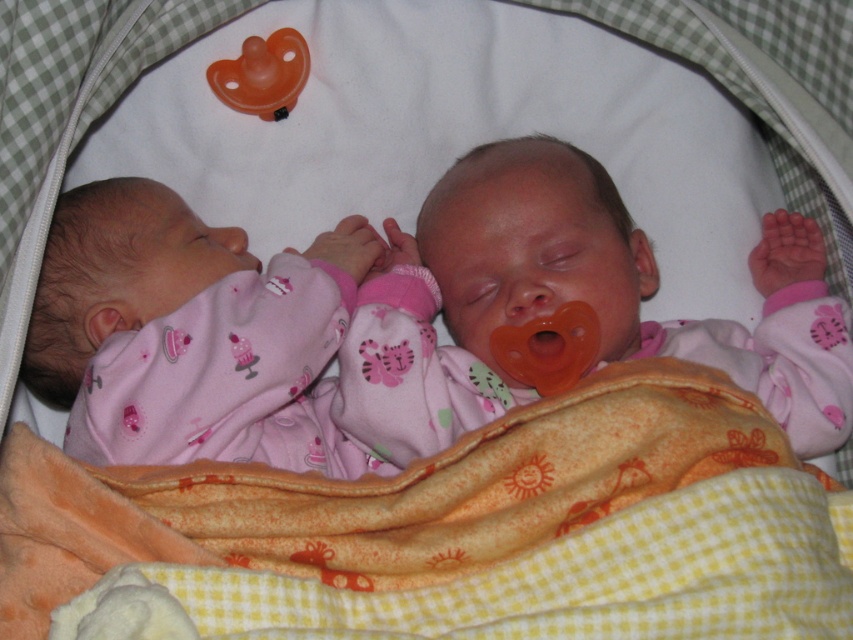
You are a nurse in a nursery and need to choose between the matte orange pacifier at center and the orange rubber pacifier at center for a baby. Which pacifier is wider?

The matte orange pacifier at center is wider than the orange rubber pacifier at center.

You are a nurse in a nursery. You need to locate the matte orange pacifier at center. Where exactly is it located in terms of coordinates?

The matte orange pacifier at center is located at point coordinates of (x=624, y=280).

You are a photographer trying to capture a closeup shot of the matte orange pacifier at center. You have a camera with a minimum focusing distance of 1 meter. Can you take the photo without moving the pacifier?

The matte orange pacifier at center is 1.03 meters away from the camera. Since the minimum focusing distance is 1 meter, the camera can focus on the matte orange pacifier at center as it is slightly beyond the required distance.